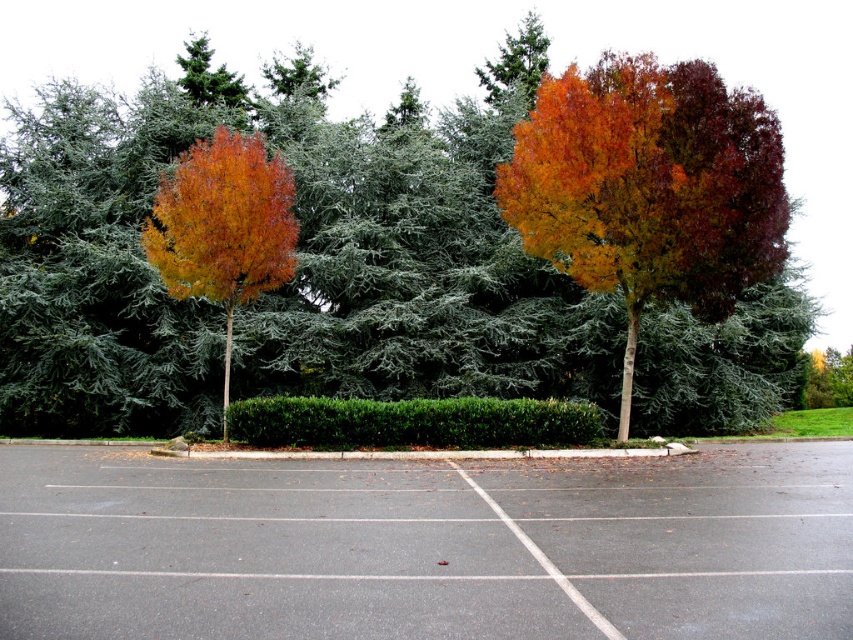
Question: Which of the following is the closest to the observer?

Choices:
 (A) autumn leaves at left
 (B) orange-brown foliage at center
 (C) multicolored bark tree at center

Answer: (C)

Question: Is orange-brown foliage at center to the left of green leafy hedge at center from the viewer's perspective?

Choices:
 (A) no
 (B) yes

Answer: (B)

Question: Which point appears farthest from the camera in this image?

Choices:
 (A) (50, 141)
 (B) (566, 560)
 (C) (245, 413)

Answer: (A)

Question: Considering the relative positions of gray asphalt parking lot at center and green leafy hedge at center in the image provided, where is gray asphalt parking lot at center located with respect to green leafy hedge at center?

Choices:
 (A) left
 (B) right

Answer: (B)

Question: Can you confirm if multicolored bark tree at center is positioned below green leafy hedge at center?

Choices:
 (A) no
 (B) yes

Answer: (A)

Question: Based on their relative distances, which object is nearer to the green leafy hedge at center?

Choices:
 (A) multicolored bark tree at center
 (B) orange-brown foliage at center
 (C) gray asphalt parking lot at center
 (D) autumn leaves at left

Answer: (D)